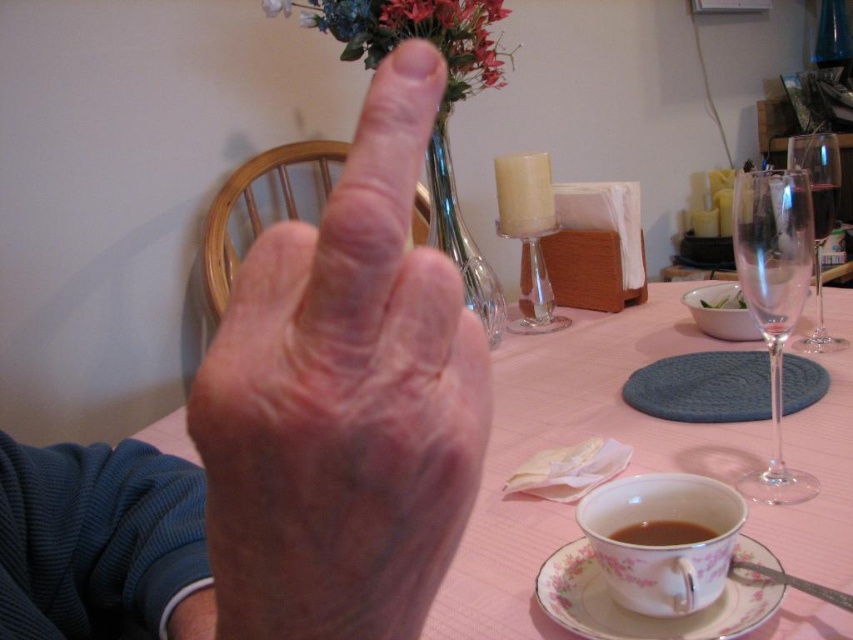
Question: Which object appears farthest from the camera in this image?

Choices:
 (A) clear glass wine glass at right
 (B) pink fabric table at center

Answer: (A)

Question: Does porcelain floral teacup at lower center come in front of brown matte cup at lower center?

Choices:
 (A) yes
 (B) no

Answer: (A)

Question: Can you confirm if pink fabric table at center is smaller than porcelain floral teacup at lower center?

Choices:
 (A) no
 (B) yes

Answer: (A)

Question: Which object is farther from the camera taking this photo?

Choices:
 (A) clear glass wine glass at right
 (B) transparent glass wine glass at right
 (C) porcelain floral saucer at lower center

Answer: (A)

Question: Based on their relative distances, which object is nearer to the dry skin hand at center?

Choices:
 (A) brown matte cup at lower center
 (B) transparent glass wine glass at right
 (C) porcelain floral saucer at lower center

Answer: (C)

Question: Does transparent glass wine glass at right have a larger size compared to clear glass wine glass at right?

Choices:
 (A) yes
 (B) no

Answer: (B)